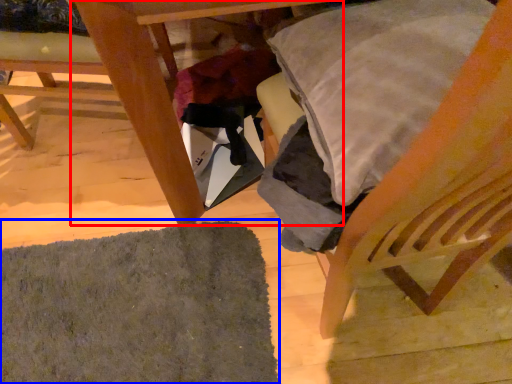
Question: Which of the following is the closest to the observer, table (highlighted by a red box) or mat (highlighted by a blue box)?

Choices:
 (A) table
 (B) mat

Answer: (A)